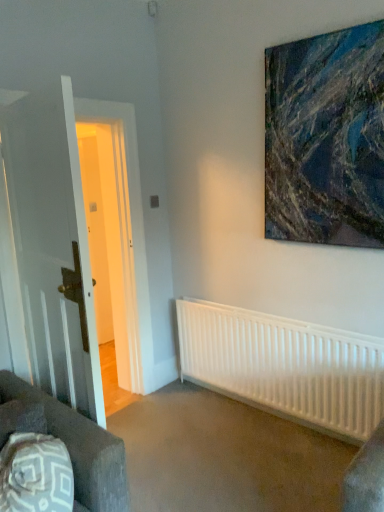
The height and width of the screenshot is (512, 384). What are the coordinates of `empty space that is ontop of abstract painting at upper right (from a real-world perspective)` in the screenshot? It's located at (317, 37).